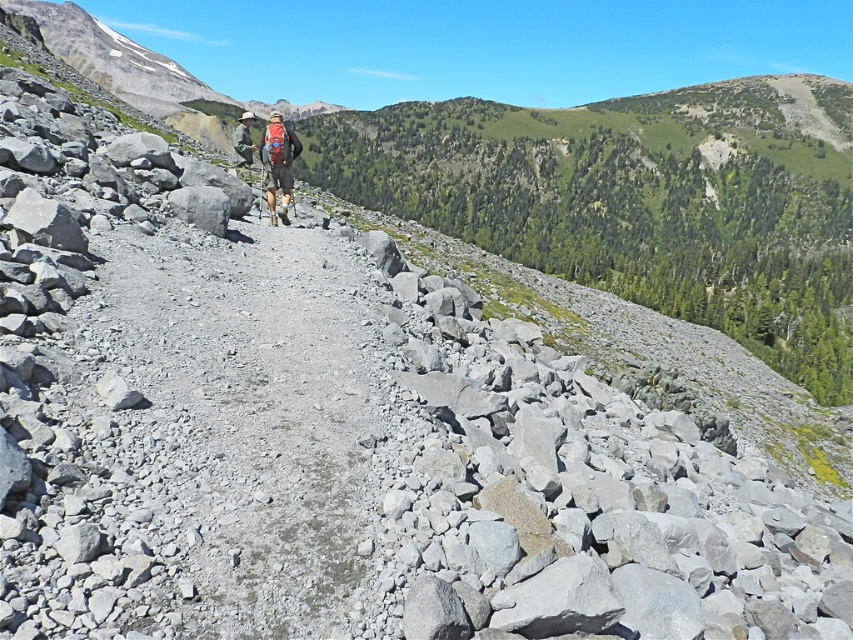
You are a hiker planning to walk along the gray gravel trail at center. The trail is located at point (247,426). If you start walking from the starting point, which direction should you head to reach the gray gravel trail at center?

The gray gravel trail at center is already at the specified point (247,426), so you are already on the trail if you are at that coordinate.

You are a hiker planning to walk along the gray gravel trail at center while carrying a camouflage fabric backpack at center. Based on the scene, can you determine if the backpack will fit comfortably on your back without hitting the trail?

The gray gravel trail at center is not as tall as camouflage fabric backpack at center, so the backpack might hit the trail if placed on your back.